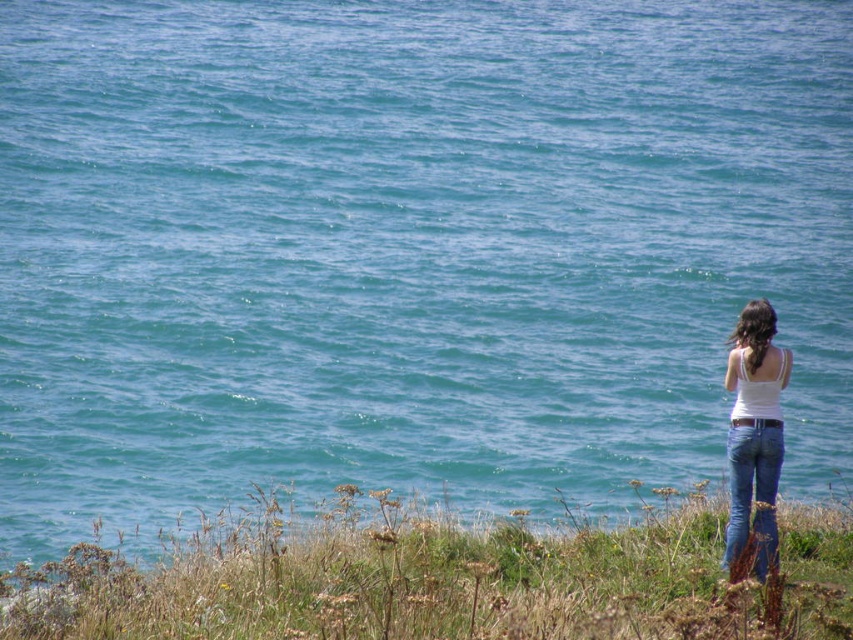
You are a photographer setting up a shot of the coastal scene. You notice the white cotton tank top at right and the blue denim jeans at lower right. Which clothing item appears larger in the frame?

The white cotton tank top at right appears larger than the blue denim jeans at lower right in the frame.

You are a photographer setting up a shot of the coastal scene. You notice the white cotton tank top at right and the blue denim jeans at lower right. Which clothing item is positioned higher in the frame?

The white cotton tank top at right is located above the blue denim jeans at lower right, so it is positioned higher in the frame.

You are a photographer setting up a tripod to capture the coastal scene. You have two items in your bag that you want to place in the frame for a composition shot. The items are the white cotton tank top at right and the blue denim jeans at lower right. Based on their sizes, which item will occupy more space horizontally in the photo?

The white cotton tank top at right will occupy more space horizontally in the photo because its width is larger than that of the blue denim jeans at lower right.